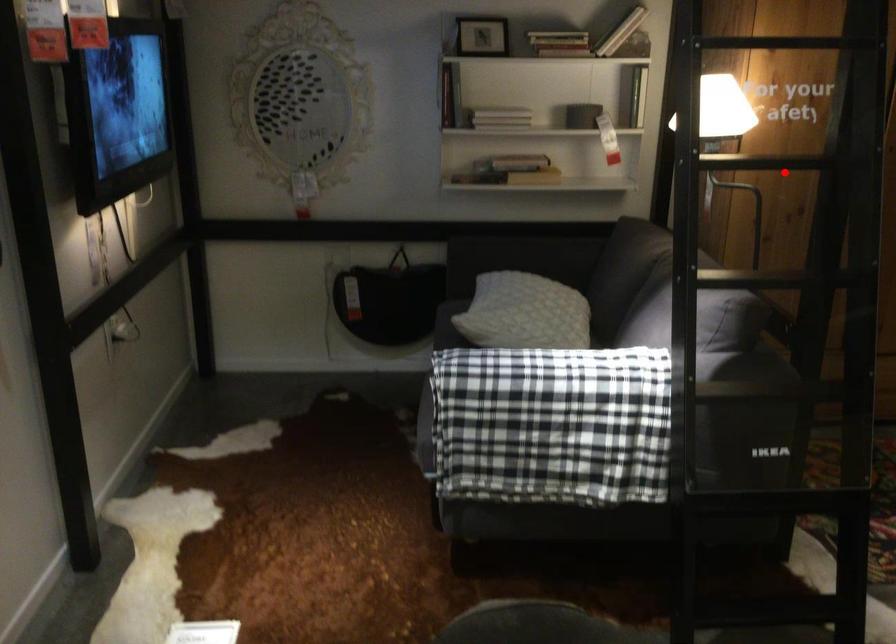
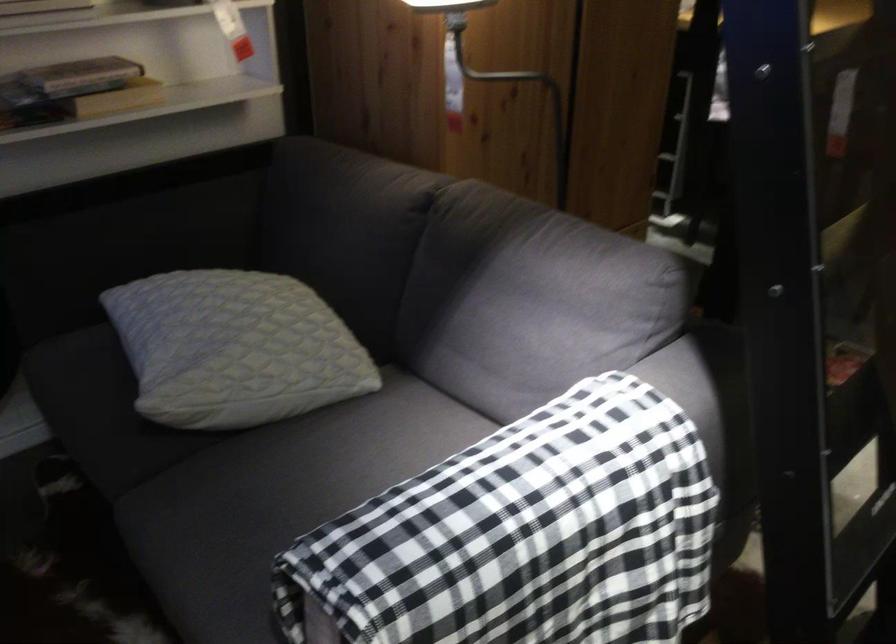
Question: I am providing you with two images of the same scene from different viewpoints. In image1, a red point is highlighted. Considering the same 3D point in image2, which of the following is correct?

Choices:
 (A) It is closer
 (B) It is farther

Answer: (A)